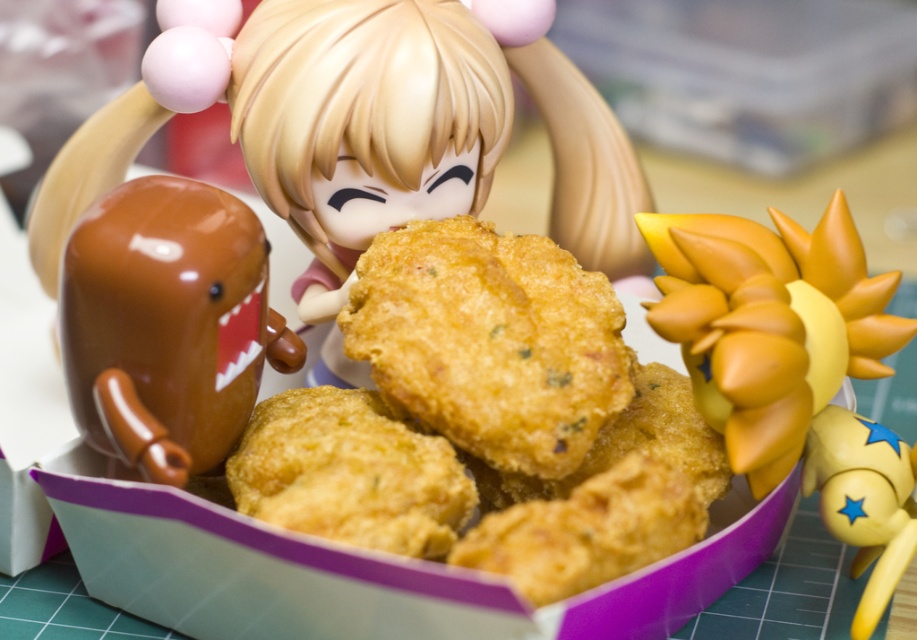
The height and width of the screenshot is (640, 917). Describe the element at coordinates (488, 420) in the screenshot. I see `golden crispy nuggets at center` at that location.

Between golden crispy nuggets at center and yellow rubber toy at lower right, which one has less height?

yellow rubber toy at lower right

Between point (319, 468) and point (821, 458), which one is positioned behind?

The point (821, 458) is behind.

The height and width of the screenshot is (640, 917). Identify the location of golden crispy nuggets at center. (488, 420).

Does golden crispy nuggets at center have a smaller size compared to glossy chocolate toy at left?

Incorrect, golden crispy nuggets at center is not smaller in size than glossy chocolate toy at left.

Between point (485, 428) and point (97, 227), which one is positioned behind?

The point (485, 428) is more distant.

Identify the location of golden crispy nuggets at center. (488, 420).

How far apart are golden crispy nugget at center and glossy chocolate toy at left?

golden crispy nugget at center is 6.61 inches from glossy chocolate toy at left.

Does golden crispy nugget at center have a larger size compared to glossy chocolate toy at left?

Correct, golden crispy nugget at center is larger in size than glossy chocolate toy at left.

Which is behind, point (506, 406) or point (202, 300)?

The point (506, 406) is more distant.

Locate an element on the screen. Image resolution: width=917 pixels, height=640 pixels. golden crispy nugget at center is located at coordinates (490, 340).